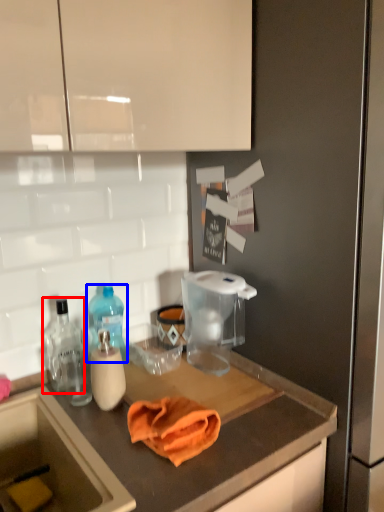
Question: Which object is closer to the camera taking this photo, bottle (highlighted by a red box) or bottle (highlighted by a blue box)?

Choices:
 (A) bottle
 (B) bottle

Answer: (A)